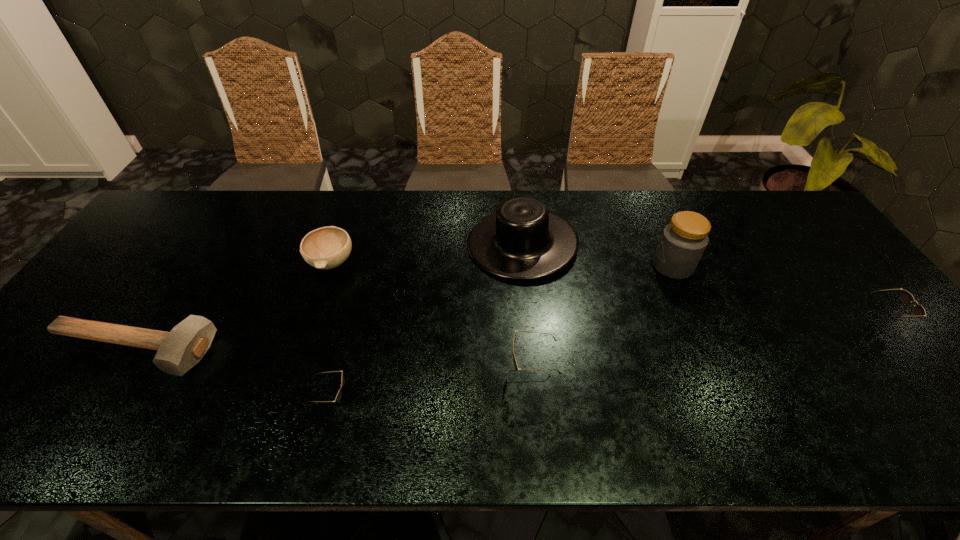
Locate an element on the screen. The image size is (960, 540). vacant space at the far right corner is located at coordinates (782, 222).

In the image, there is a desktop. Where is `free space at the near right corner`? The width and height of the screenshot is (960, 540). free space at the near right corner is located at coordinates (870, 383).

At what (x,y) coordinates should I click in order to perform the action: click on free space between the second tallest object and the mallet. Please return your answer as a coordinate pair (x, y). The image size is (960, 540). Looking at the image, I should click on (326, 297).

You are a GUI agent. You are given a task and a screenshot of the screen. Output one action in this format:
    pyautogui.click(x=<x>, y=<y>)
    Task: Click on the free space between the shortest object and the tallest object
    
    Given the screenshot: What is the action you would take?
    pyautogui.click(x=402, y=308)

This screenshot has width=960, height=540. I want to click on free space between the rightmost sunglasses and the leftmost object, so click(505, 336).

Image resolution: width=960 pixels, height=540 pixels. Find the location of `free space between the rightmost sunglasses and the jar`. free space between the rightmost sunglasses and the jar is located at coordinates (776, 294).

You are a GUI agent. You are given a task and a screenshot of the screen. Output one action in this format:
    pyautogui.click(x=<x>, y=<y>)
    Task: Click on the free spot between the bowl and the leftmost sunglasses
    
    Given the screenshot: What is the action you would take?
    pyautogui.click(x=332, y=332)

At what (x,y) coordinates should I click in order to perform the action: click on vacant region between the shortest object and the leftmost sunglasses. Please return your answer as a coordinate pair (x, y). The width and height of the screenshot is (960, 540). Looking at the image, I should click on (231, 376).

Find the location of a particular element. The width and height of the screenshot is (960, 540). unoccupied position between the bowl and the mallet is located at coordinates (231, 307).

Find the location of `free space between the rightmost sunglasses and the tallest object`. free space between the rightmost sunglasses and the tallest object is located at coordinates (776, 294).